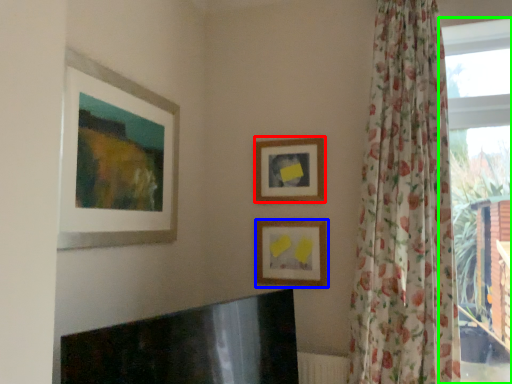
Question: Estimate the real-world distances between objects in this image. Which object is closer to picture frame (highlighted by a red box), picture frame (highlighted by a blue box) or window (highlighted by a green box)?

Choices:
 (A) picture frame
 (B) window

Answer: (A)